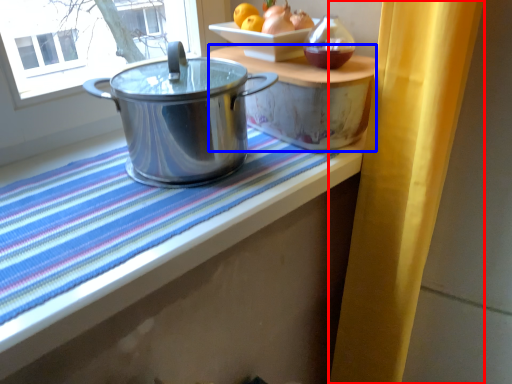
Question: Which point is closer to the camera, curtain (highlighted by a red box) or table (highlighted by a blue box)?

Choices:
 (A) curtain
 (B) table

Answer: (A)